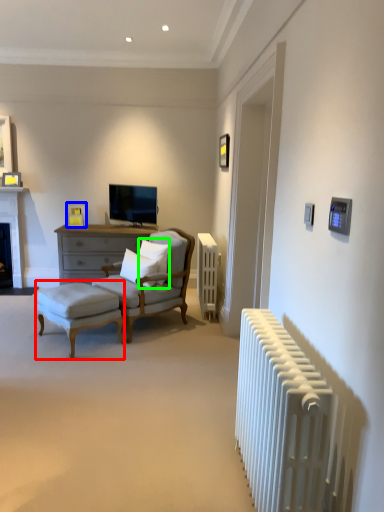
Question: Which is nearer to the table (highlighted by a red box)? picture frame (highlighted by a blue box) or pillow (highlighted by a green box).

Choices:
 (A) picture frame
 (B) pillow

Answer: (B)